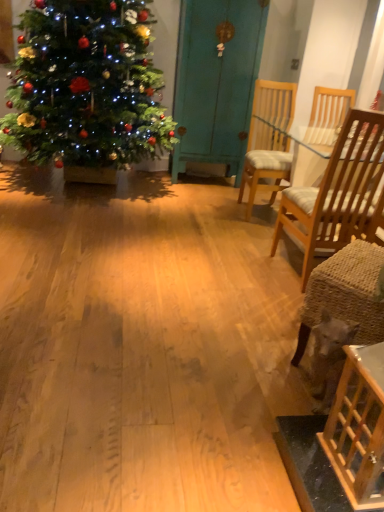
What are the coordinates of `free region on the left part of light brown wood chair at right, which is the first chair from front to back` in the screenshot? It's located at (247, 270).